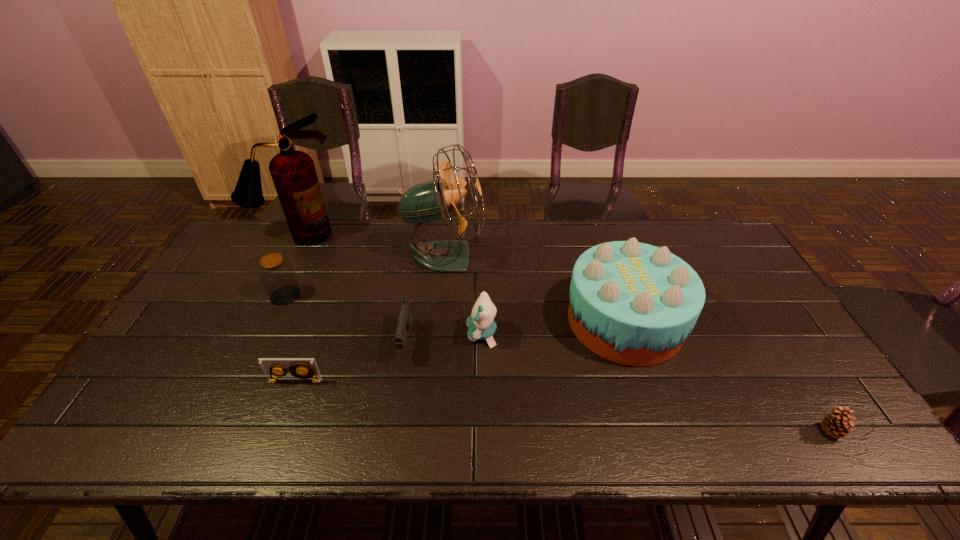
This screenshot has width=960, height=540. I want to click on fire extinguisher present at the far edge, so click(293, 172).

Where is `fan at the far edge`? fan at the far edge is located at coordinates (428, 201).

Identify the location of object present at the near edge. pyautogui.click(x=837, y=423).

Image resolution: width=960 pixels, height=540 pixels. I want to click on object that is at the left edge, so pyautogui.click(x=293, y=172).

Find the location of a particular element. Image resolution: width=960 pixels, height=540 pixels. object that is at the right edge is located at coordinates (837, 423).

Where is `object at the far left corner`? object at the far left corner is located at coordinates (293, 172).

Identify the location of object positioned at the near right corner. (837, 423).

Where is `free space at the far edge of the desktop`? The width and height of the screenshot is (960, 540). free space at the far edge of the desktop is located at coordinates (497, 227).

Where is `vacant space at the near edge of the desktop`? The height and width of the screenshot is (540, 960). vacant space at the near edge of the desktop is located at coordinates (618, 432).

The image size is (960, 540). Find the location of `vacant space at the left edge of the desktop`. vacant space at the left edge of the desktop is located at coordinates (142, 391).